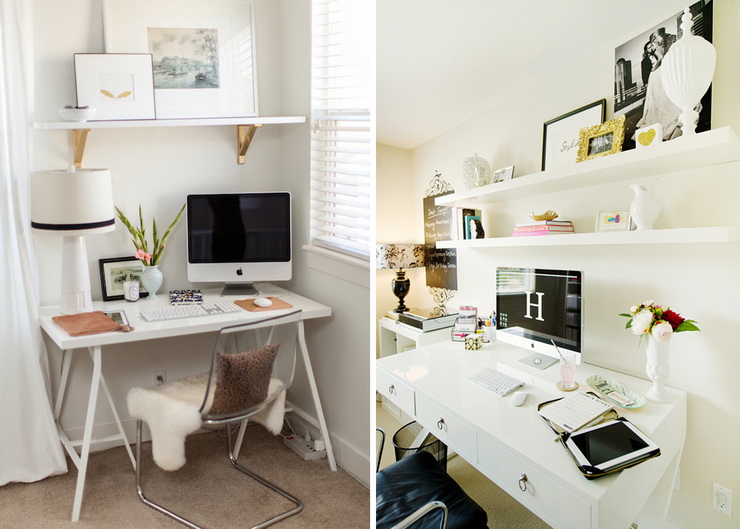
Image resolution: width=740 pixels, height=529 pixels. In order to click on lamp in this screenshot , I will do `click(81, 208)`.